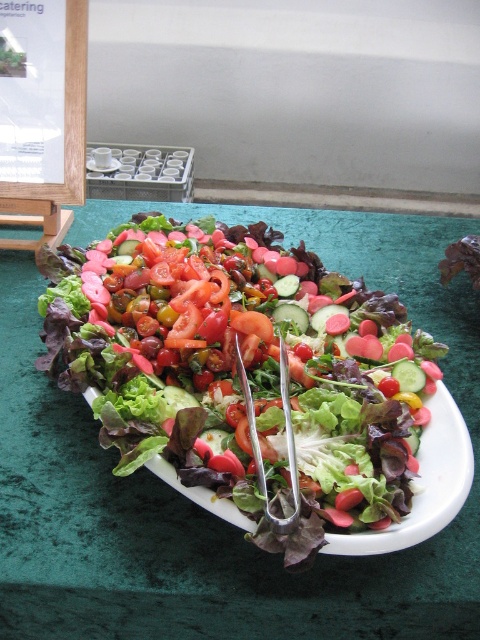
You are a food stylist who needs to adjust the placement of the fresh green salad at center and the white ceramic plate at center so that they are exactly 30 inches apart. Currently, they are 33.57 inches apart. Which object should you move closer to the other to achieve the desired distance?

To reduce the distance between the fresh green salad at center and the white ceramic plate at center from 33.57 inches to 30 inches, you should move either the salad or the plate toward the other by approximately 1.785 inches. Moving either object closer will achieve the desired 30 inches apart.

You are at the center of the image and want to grab the silver tongs. Which direction should you move relative to the fresh green salad at center?

The fresh green salad at center is located at point (240,371). Since you are at the center of the image, you need to move towards the right to reach the silver tongs, which are placed on the salad.

You are at the point labeled point [91,164] and want to reach the point labeled point [316,298]. Which direction should you move in to get there?

To move from point [91,164] to point [316,298], you should move towards the upper right direction since point [316,298] is located in front of point [91,164].